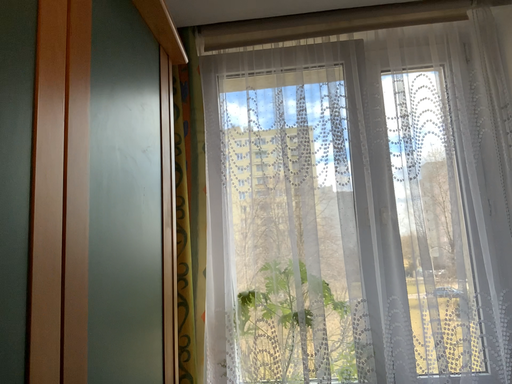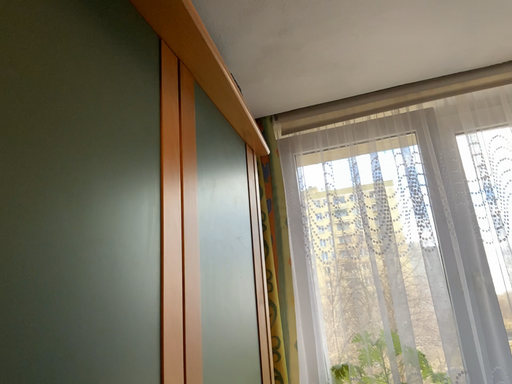
Question: How did the camera likely rotate when shooting the video?

Choices:
 (A) rotated right
 (B) rotated left

Answer: (B)